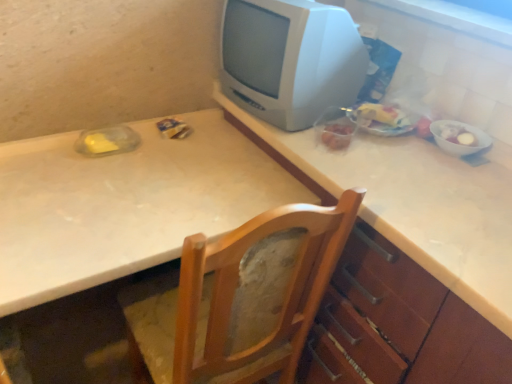
The height and width of the screenshot is (384, 512). In order to click on free space in front of white plastic television at upper right in this screenshot , I will do `click(358, 160)`.